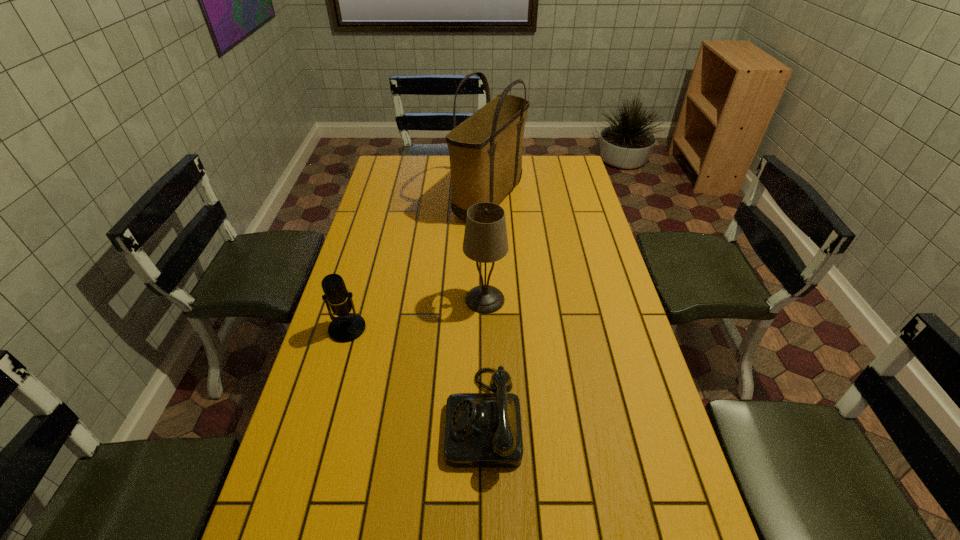
Find the location of a particular element. vacant space situated 0.270m on the front-facing side of the lampshade is located at coordinates (378, 299).

Find the location of a particular element. free location located 0.160m on the front-facing side of the lampshade is located at coordinates (414, 299).

The image size is (960, 540). In order to click on vacant space situated on the back of the third farthest object in this screenshot , I will do `click(358, 289)`.

Identify the location of vacant space located 0.060m on the dial of the nearest object. (422, 417).

Locate an element on the screen. vacant space located on the dial of the nearest object is located at coordinates (395, 417).

This screenshot has height=540, width=960. I want to click on free space located on the dial of the nearest object, so (x=395, y=417).

Where is `object that is at the far edge`? object that is at the far edge is located at coordinates (485, 150).

Locate an element on the screen. This screenshot has height=540, width=960. object that is at the left edge is located at coordinates (346, 327).

The width and height of the screenshot is (960, 540). Identify the location of free location at the far edge of the desktop. (540, 177).

You are a GUI agent. You are given a task and a screenshot of the screen. Output one action in this format:
    pyautogui.click(x=<x>, y=<y>)
    Task: Click on the vacant space at the left edge
    This screenshot has width=960, height=540.
    Given the screenshot: What is the action you would take?
    pyautogui.click(x=366, y=240)